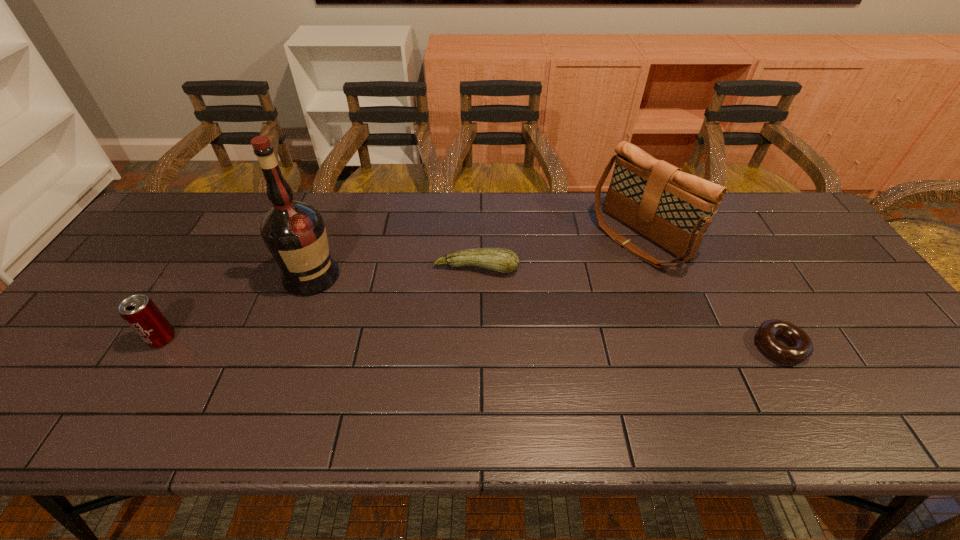
You are a GUI agent. You are given a task and a screenshot of the screen. Output one action in this format:
    pyautogui.click(x=<x>, y=<y>)
    Task: Click on the beer can
    The height and width of the screenshot is (540, 960).
    Given the screenshot: What is the action you would take?
    pyautogui.click(x=142, y=315)

Identify the location of the third tallest object. This screenshot has height=540, width=960. (142, 315).

Identify the location of doughnut. (801, 348).

Where is `the rightmost object`? the rightmost object is located at coordinates (801, 348).

I want to click on the tallest object, so click(294, 232).

This screenshot has width=960, height=540. Find the location of `the second object from left to right`. the second object from left to right is located at coordinates (294, 232).

Locate an element on the screen. The height and width of the screenshot is (540, 960). zucchini is located at coordinates (502, 260).

In order to click on the third object from right to left in this screenshot , I will do `click(502, 260)`.

Identify the location of shoulder bag. This screenshot has height=540, width=960. (672, 208).

Image resolution: width=960 pixels, height=540 pixels. What are the coordinates of `the second object from right to left` in the screenshot? It's located at (672, 208).